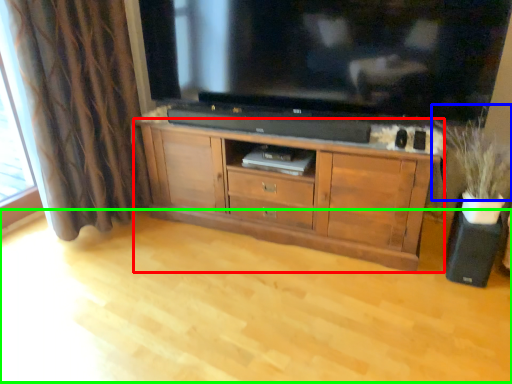
Question: Estimate the real-world distances between objects in this image. Which object is farther from cabinetry (highlighted by a red box), plant (highlighted by a blue box) or plain (highlighted by a green box)?

Choices:
 (A) plant
 (B) plain

Answer: (A)